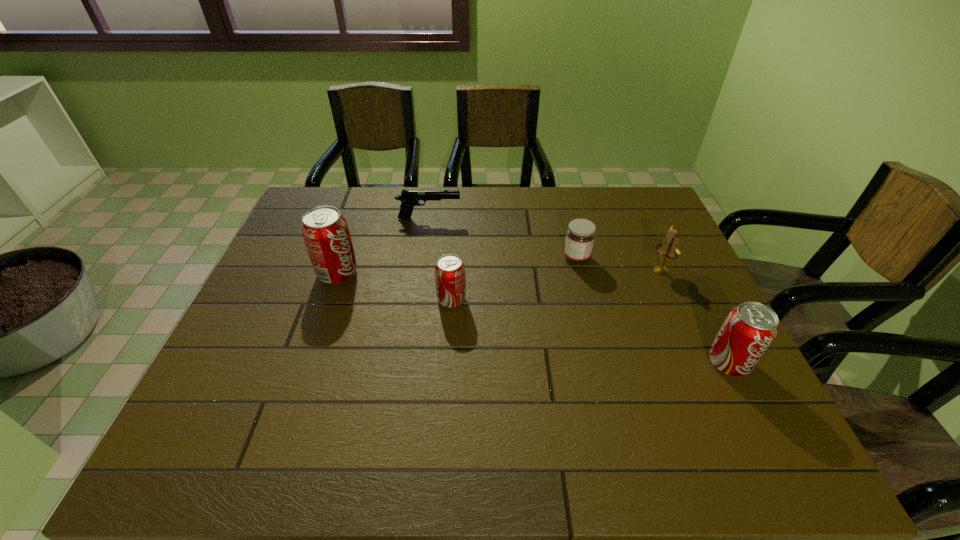
This screenshot has width=960, height=540. Find the location of `blank region between the second nearest object and the candle holder`. blank region between the second nearest object and the candle holder is located at coordinates (556, 285).

The image size is (960, 540). I want to click on vacant space that's between the tallest soda and the gun, so click(x=383, y=246).

I want to click on empty space between the nearest object and the candle holder, so click(x=695, y=316).

Where is `vacant area that lies between the candle holder and the tallest soda`? This screenshot has height=540, width=960. vacant area that lies between the candle holder and the tallest soda is located at coordinates (499, 272).

Where is `empty space that is in between the farthest object and the leftmost soda`? empty space that is in between the farthest object and the leftmost soda is located at coordinates (383, 246).

Find the location of a particular element. vacant space that is in between the fourth object from left to right and the second tallest soda is located at coordinates (653, 310).

This screenshot has width=960, height=540. Identify the location of free spot between the jam and the rightmost soda. (653, 310).

Identify which object is the fifth nearest to the farthest object. Please provide its 2D coordinates. Your answer should be formatted as a tuple, i.e. [(x, y)], where the tuple contains the x and y coordinates of a point satisfying the conditions above.

[(748, 331)]

Locate an element on the screen. The image size is (960, 540). the third closest object to the farthest object is located at coordinates (580, 235).

I want to click on soda that can be found as the closest to the rightmost soda, so click(450, 280).